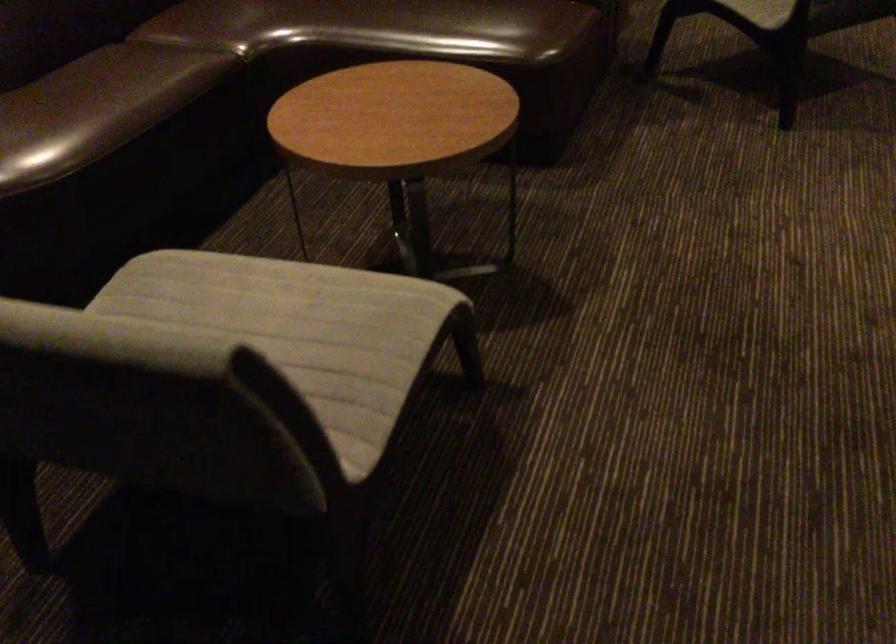
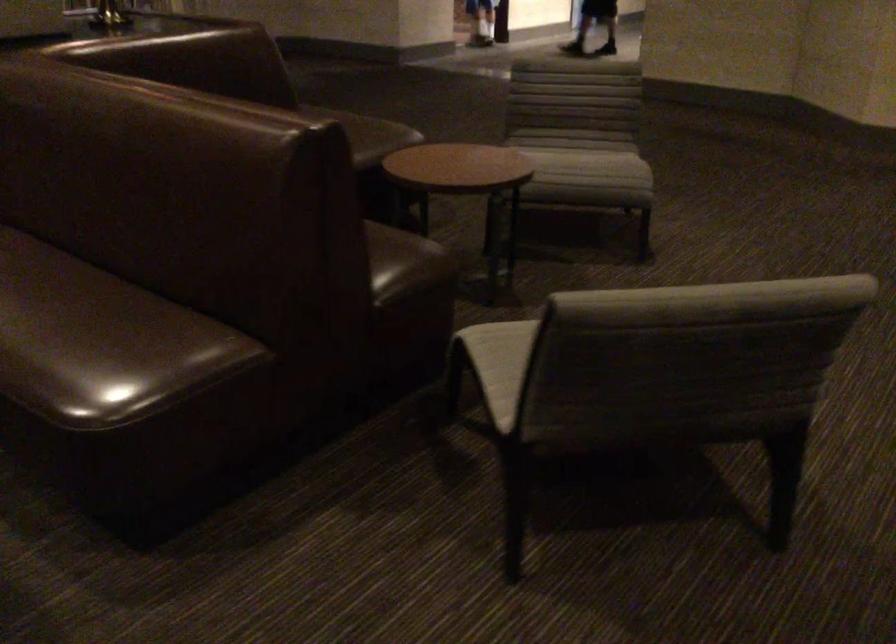
What movement of the cameraman would produce the second image?

The cameraman walked toward right, forward.